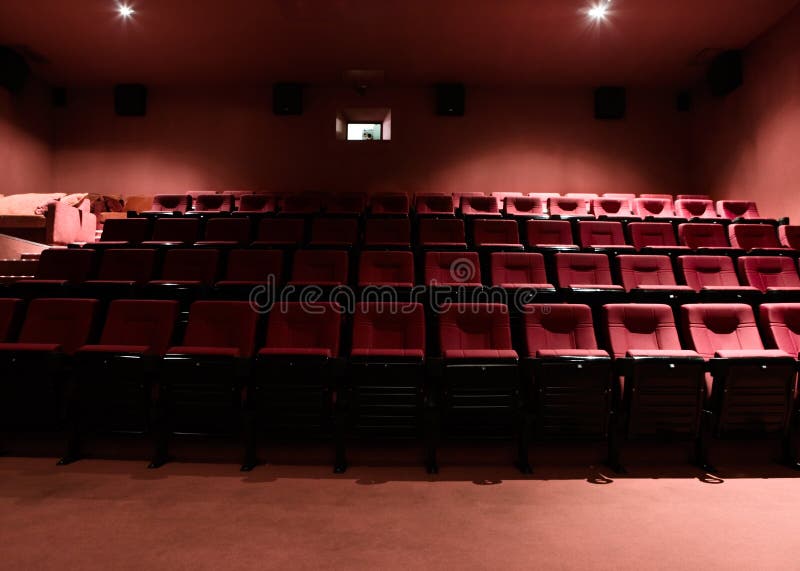
The image size is (800, 571). What are the coordinates of `speaker` in the screenshot? It's located at (602, 104), (457, 103), (302, 103), (136, 108), (682, 94), (726, 71), (58, 95), (21, 75).